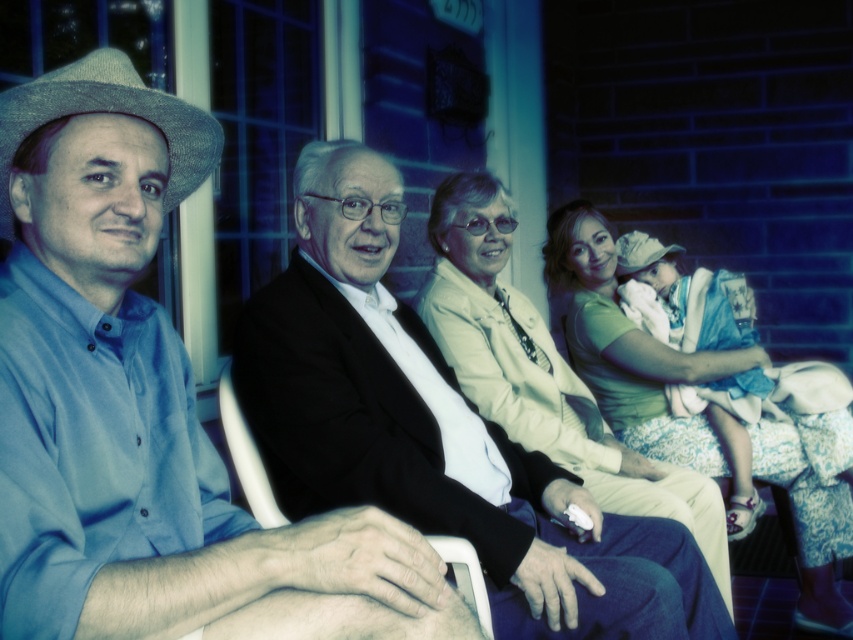
Based on the scene description, which object is larger in size between the matte green shirt at right and the white plastic chair at center?

The matte green shirt at right is bigger than the white plastic chair at center according to the description.

You are a photographer standing at the camera position. You want to take a closeup shot of the light beige fabric jacket at center without moving the jacket. Can you adjust your camera zoom to focus on it clearly?

The light beige fabric jacket at center is 1.53 meters away from the camera, so yes, you can adjust the camera zoom to focus on it clearly from that distance.